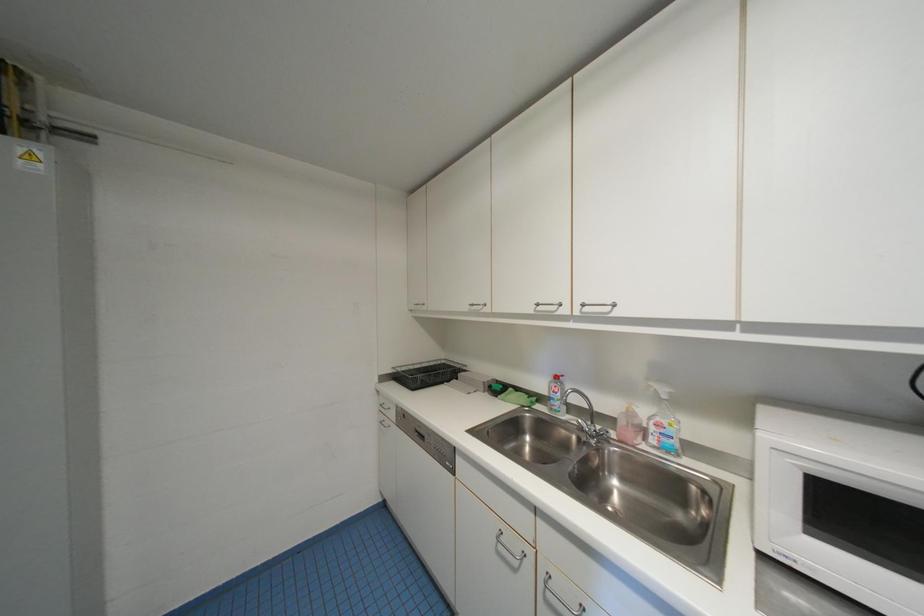
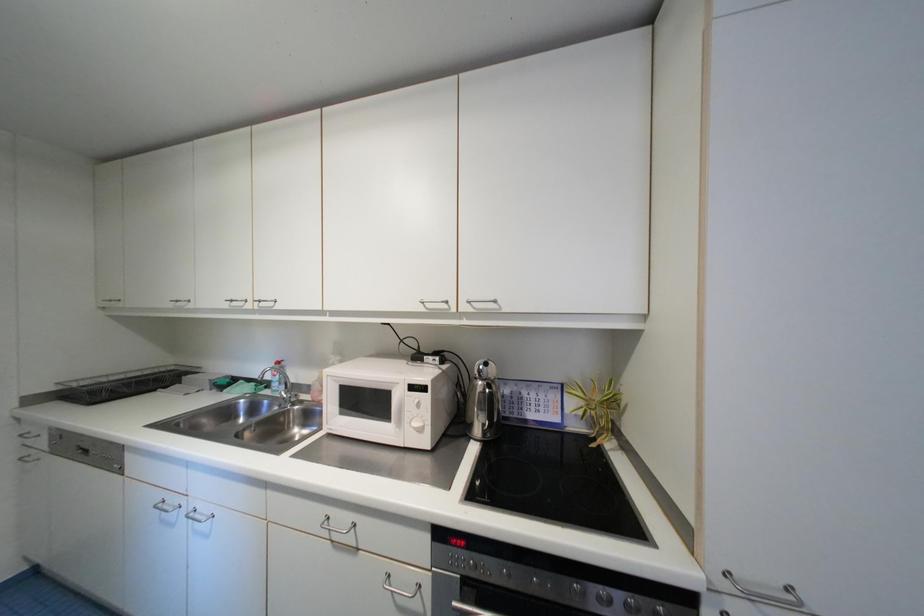
Question: How did the camera likely rotate?

Choices:
 (A) Left
 (B) Right
 (C) Up
 (D) Down

Answer: (B)